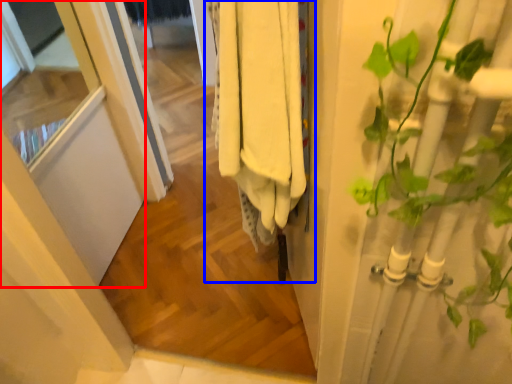
Question: Among these objects, which one is nearest to the camera, screen door (highlighted by a red box) or closet (highlighted by a blue box)?

Choices:
 (A) screen door
 (B) closet

Answer: (B)